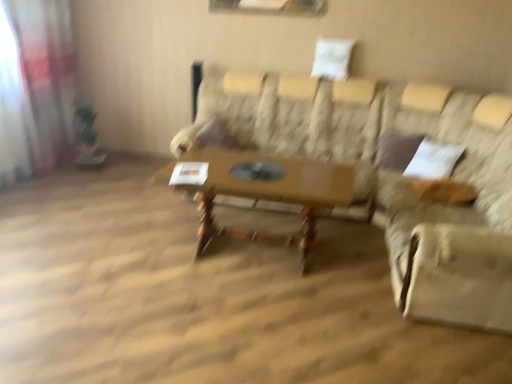
This screenshot has width=512, height=384. Identify the location of vacant area that lies in front of wooden table at center. (251, 323).